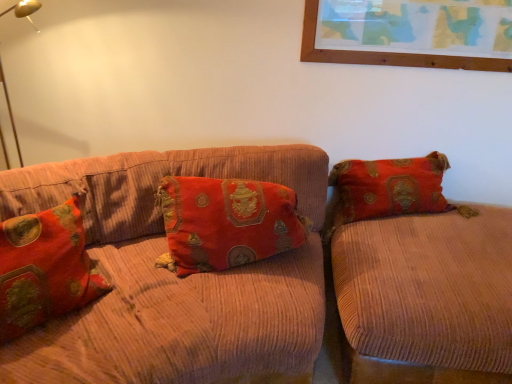
Question: Relative to corduroy couch at center, the 2th studio couch positioned from the right, is velvet orange couch at right, which appears as the 1th studio couch when viewed from the right, in front or behind?

Choices:
 (A) front
 (B) behind

Answer: (B)

Question: Based on their sizes in the image, would you say velvet orange couch at right, which appears as the 1th studio couch when viewed from the right, is bigger or smaller than corduroy couch at center, which is counted as the first studio couch, starting from the left?

Choices:
 (A) big
 (B) small

Answer: (B)

Question: Which of these objects is positioned farthest from the velvet orange couch at right, the second studio couch when ordered from left to right?

Choices:
 (A) velvet-like red pillow at left, which is the 1th pillow in left-to-right order
 (B) velvet-like red pillow at center, which appears as the 1th pillow when viewed from the right
 (C) corduroy couch at center, which is counted as the first studio couch, starting from the left

Answer: (A)

Question: Estimate the real-world distances between objects in this image. Which object is farther from the velvet-like red pillow at center, the second pillow positioned from the left?

Choices:
 (A) corduroy couch at center, which is counted as the first studio couch, starting from the left
 (B) velvet-like red pillow at left, which is the 1th pillow in left-to-right order
 (C) velvet orange couch at right, which appears as the 1th studio couch when viewed from the right

Answer: (C)